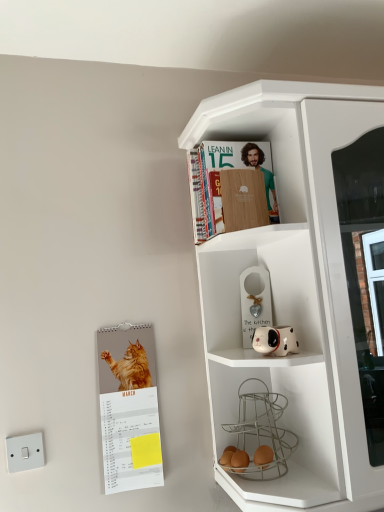
Question: Does white glossy dog-shaped planter at middle right have a lesser width compared to wooden cover book at upper center?

Choices:
 (A) no
 (B) yes

Answer: (B)

Question: Is white glossy dog-shaped planter at middle right positioned beyond the bounds of wooden cover book at upper center?

Choices:
 (A) no
 (B) yes

Answer: (B)

Question: From the image's perspective, is white glossy dog-shaped planter at middle right over wooden cover book at upper center?

Choices:
 (A) yes
 (B) no

Answer: (B)

Question: Considering the relative positions of white glossy dog-shaped planter at middle right and wooden cover book at upper center in the image provided, is white glossy dog-shaped planter at middle right behind wooden cover book at upper center?

Choices:
 (A) no
 (B) yes

Answer: (A)

Question: Is white glossy dog-shaped planter at middle right oriented towards wooden cover book at upper center?

Choices:
 (A) no
 (B) yes

Answer: (A)

Question: Is the surface of white glossy dog-shaped planter at middle right in direct contact with wooden cover book at upper center?

Choices:
 (A) yes
 (B) no

Answer: (B)

Question: Considering the relative sizes of white glossy dog-shaped planter at middle right and orange fur cat calendar at left in the image provided, is white glossy dog-shaped planter at middle right wider than orange fur cat calendar at left?

Choices:
 (A) yes
 (B) no

Answer: (A)

Question: Does white glossy dog-shaped planter at middle right appear on the left side of orange fur cat calendar at left?

Choices:
 (A) no
 (B) yes

Answer: (A)

Question: Is white glossy dog-shaped planter at middle right closer to the viewer compared to orange fur cat calendar at left?

Choices:
 (A) yes
 (B) no

Answer: (A)

Question: Can you confirm if white glossy dog-shaped planter at middle right is taller than orange fur cat calendar at left?

Choices:
 (A) no
 (B) yes

Answer: (A)

Question: Is white glossy dog-shaped planter at middle right looking in the opposite direction of orange fur cat calendar at left?

Choices:
 (A) yes
 (B) no

Answer: (B)

Question: Does white glossy dog-shaped planter at middle right have a lesser width compared to orange fur cat calendar at left?

Choices:
 (A) yes
 (B) no

Answer: (B)

Question: Is orange fur cat calendar at left oriented towards white plastic switch at lower left?

Choices:
 (A) yes
 (B) no

Answer: (B)